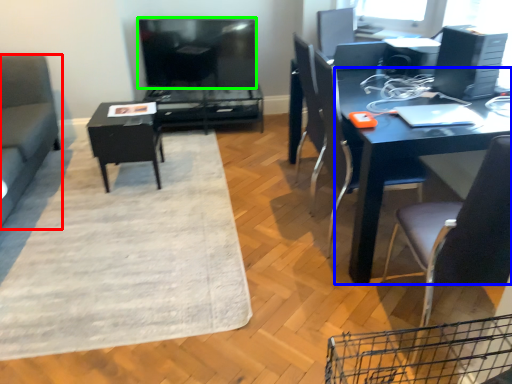
Question: Estimate the real-world distances between objects in this image. Which object is closer to studio couch (highlighted by a red box), desk (highlighted by a blue box) or television (highlighted by a green box)?

Choices:
 (A) desk
 (B) television

Answer: (B)